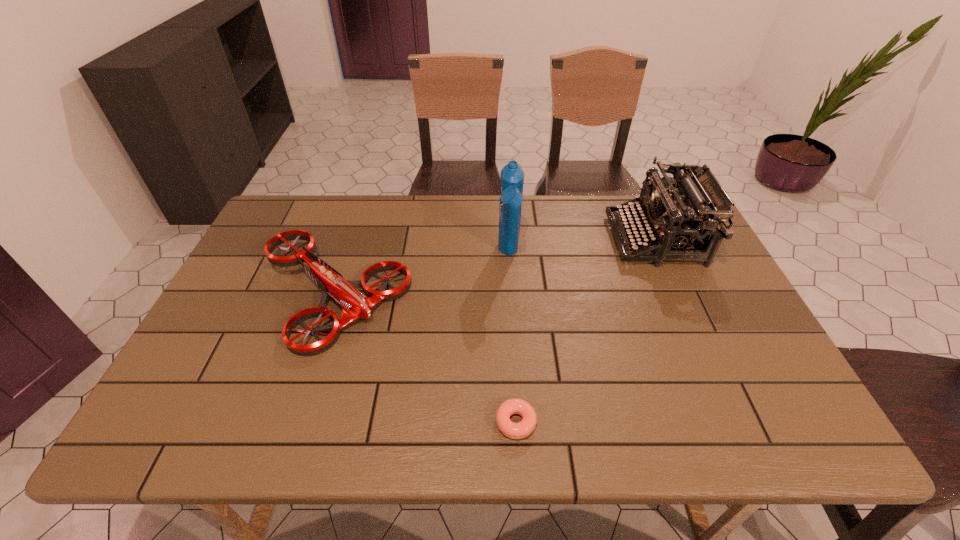
Locate an element on the screen. This screenshot has width=960, height=540. vacant space located 0.360m on the typing side of the typewriter is located at coordinates coord(495,239).

Where is `vacant position located on the left of the leftmost object`? The image size is (960, 540). vacant position located on the left of the leftmost object is located at coordinates (231, 296).

The height and width of the screenshot is (540, 960). Identify the location of blank area located on the left of the nearest object. tap(320, 422).

What are the coordinates of `shampoo present at the far edge` in the screenshot? It's located at (512, 176).

Locate an element on the screen. The image size is (960, 540). typewriter that is at the far edge is located at coordinates (678, 222).

Where is `object that is at the near edge`? The image size is (960, 540). object that is at the near edge is located at coordinates (525, 427).

At what (x,y) coordinates should I click in order to perform the action: click on object situated at the left edge. Please return your answer as a coordinate pair (x, y). Looking at the image, I should click on (355, 305).

Find the location of a particular element. The width and height of the screenshot is (960, 540). object positioned at the right edge is located at coordinates (678, 222).

At what (x,y) coordinates should I click in order to perform the action: click on object located in the far right corner section of the desktop. Please return your answer as a coordinate pair (x, y). Image resolution: width=960 pixels, height=540 pixels. Looking at the image, I should click on (678, 222).

In the image, there is a desktop. At what (x,y) coordinates should I click in order to perform the action: click on free region at the far edge. Please return your answer as a coordinate pair (x, y). The image size is (960, 540). Looking at the image, I should click on (385, 202).